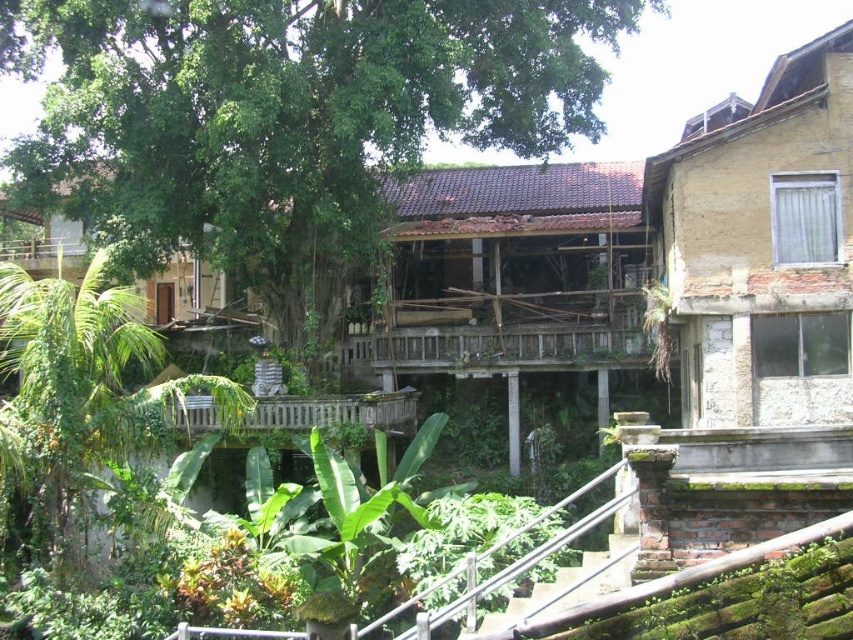
You are standing at point (285, 116) in the residential area. What object is directly in front of you?

The green leafy tree at center is directly in front of you at point (285, 116).

You are standing at the base of the staircase leading to the weathered building. You want to take a photo of the two story beige stucco building with the white framed window. To avoid including the green leafy tree at center in your photo, where should you position yourself relative to the staircase?

To avoid including the green leafy tree at center in your photo, you should position yourself to the right of the staircase since the tree is located at point (x=285, y=116), which is to the left of the staircase.

You are planning to install a new fence between the green leafy tree at center and the green leafy tree at left. Considering their sizes, which tree will require more space for the fence to accommodate its width?

The green leafy tree at center has a larger width than the green leafy tree at left, so the fence between them will need to be wider to accommodate the green leafy tree at center.